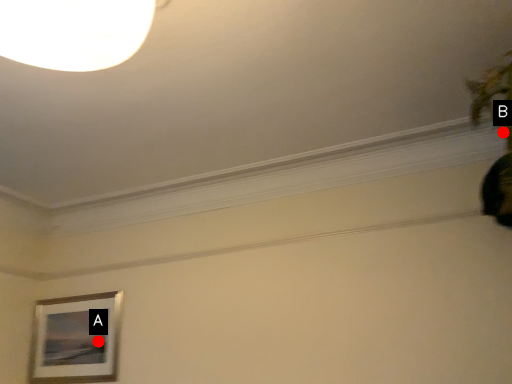
Question: Two points are circled on the image, labeled by A and B beside each circle. Among these points, which one is nearest to the camera?

Choices:
 (A) A is closer
 (B) B is closer

Answer: (B)